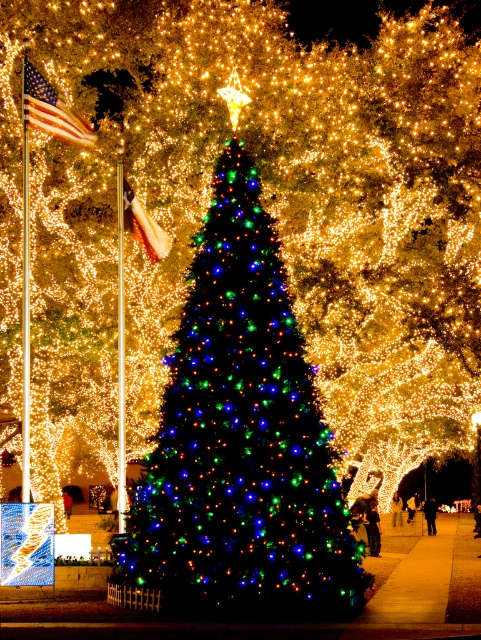
Does point (435, 532) come behind point (401, 520)?

No, it is not.

Between black leather jacket at center and yellow fabric bag at center, which one appears on the right side from the viewer's perspective?

From the viewer's perspective, black leather jacket at center appears more on the right side.

Locate an element on the screen. black leather jacket at center is located at coordinates (430, 513).

Is multicolored lights christmas tree at center to the right of dark blue jeans at center from the viewer's perspective?

Incorrect, multicolored lights christmas tree at center is not on the right side of dark blue jeans at center.

Can you confirm if multicolored lights christmas tree at center is taller than dark blue jeans at center?

Yes, multicolored lights christmas tree at center is taller than dark blue jeans at center.

Which is in front, point (291, 384) or point (414, 500)?

Positioned in front is point (291, 384).

In order to click on multicolored lights christmas tree at center in this screenshot , I will do `click(240, 444)`.

Is point (25, 106) behind point (137, 212)?

No, (25, 106) is closer to viewer.

Which is behind, point (90, 132) or point (131, 195)?

Positioned behind is point (131, 195).

Who is more forward, (68, 131) or (126, 189)?

Point (68, 131) is in front.

The image size is (481, 640). I want to click on american flag at upper left, so click(x=51, y=109).